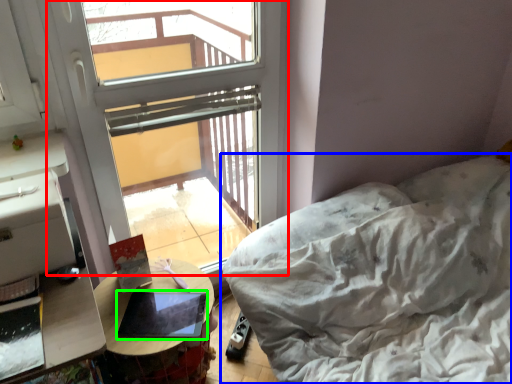
Question: Considering the real-world distances, which object is farthest from window (highlighted by a red box)? furniture (highlighted by a blue box) or laptop (highlighted by a green box)?

Choices:
 (A) furniture
 (B) laptop

Answer: (A)